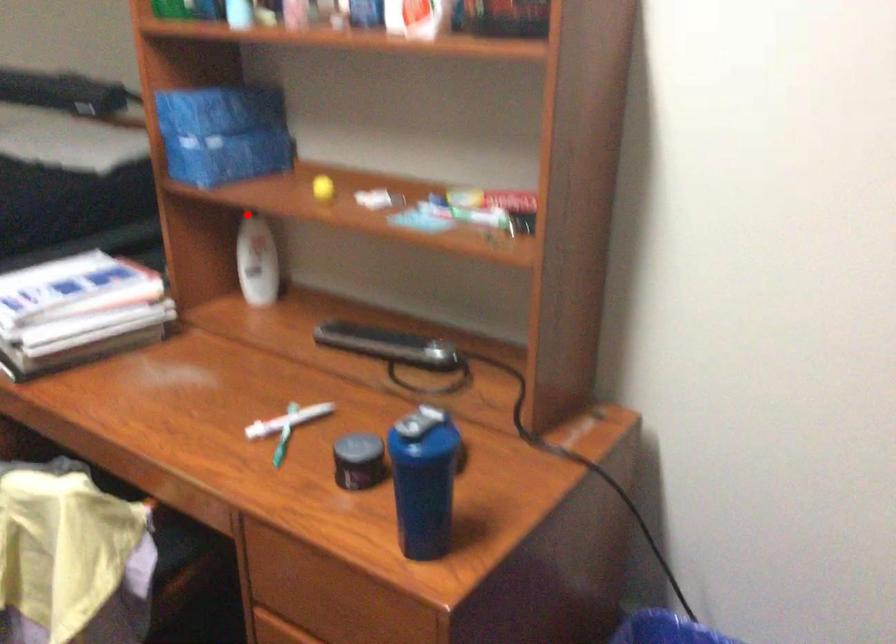
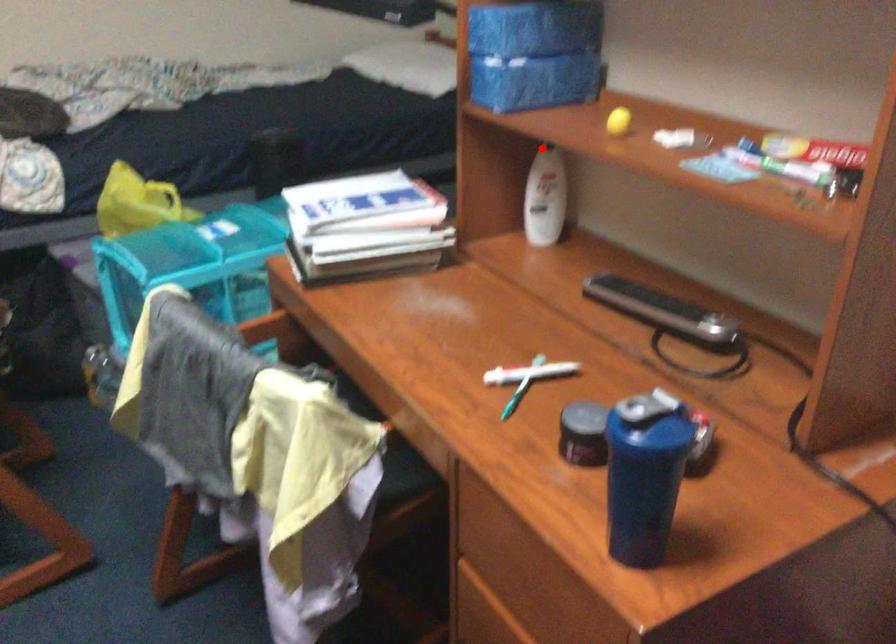
Based on the photo, I am providing you with two images of the same scene from different viewpoints. A red point is marked on the first image and another point is marked on the second image. Are the points marked in image1 and image2 representing the same 3D position?

Yes